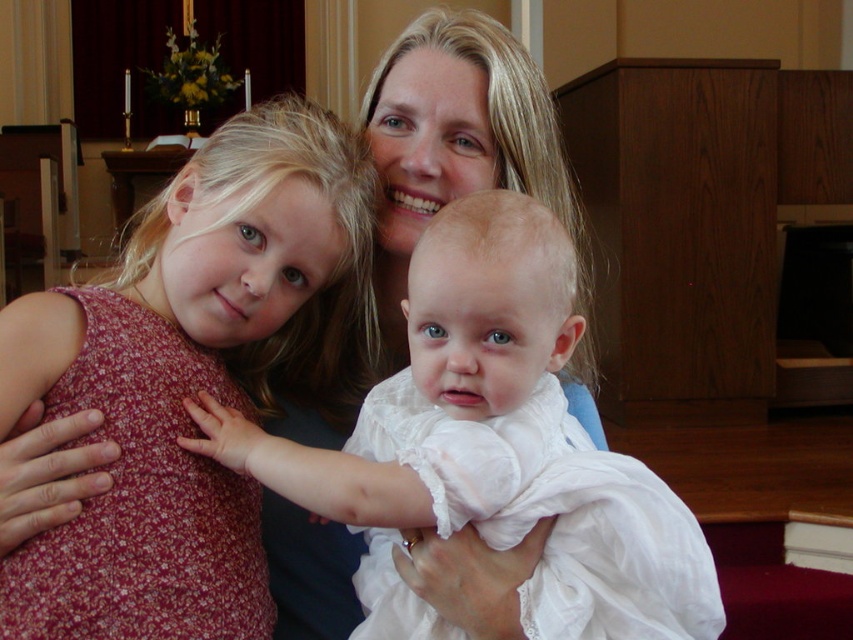
You are a photographer setting up for a family portrait. You have two dresses to choose from for the main subject. The floral fabric dress at left and the white lace dress at center. Based on the scene description, which dress is taller?

The floral fabric dress at left is taller than the white lace dress at center according to the scene description.

You are standing in the church and want to take a photo of the baby in the white outfit. There is a floral fabric dress at left represented by point (x=198, y=381). To avoid distractions, you need to ensure the dress isn not in the frame. Should you move left or right to exclude the dress?

The floral fabric dress at left is located at point (x=198, y=381). To exclude it from the frame, move to the right side.

You are standing in the church and want to take a photo of the point at coordinates point (83,360). If your camera has a focal length of 35mm and you are currently 36.94 inches away from the point, should you move closer or farther away to ensure the point fills the frame properly?

The point at coordinates point (83,360) is 36.94 inches away from you. To fill the frame properly, you should move closer to the point since the recommended distance for a 35mm camera to fill the frame with a subject at that point would typically require being closer than 36.94 inches.